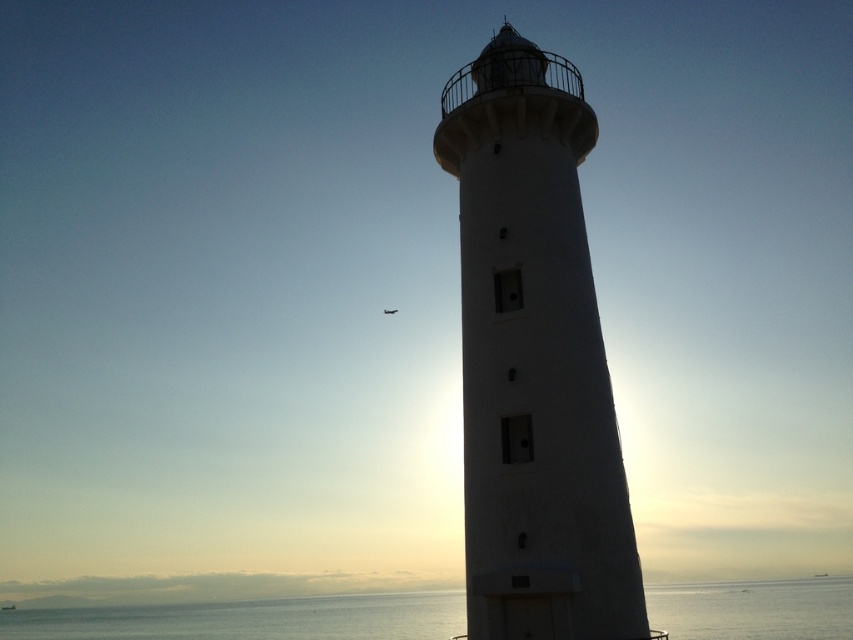
Question: Does white smooth lighthouse at center appear on the right side of transparent water at lower center?

Choices:
 (A) no
 (B) yes

Answer: (B)

Question: Is white smooth lighthouse at center further to camera compared to transparent water at lower center?

Choices:
 (A) no
 (B) yes

Answer: (A)

Question: Which of the following is the farthest from the observer?

Choices:
 (A) transparent water at lower center
 (B) white smooth lighthouse at center

Answer: (A)

Question: Which object appears farthest from the camera in this image?

Choices:
 (A) white smooth lighthouse at center
 (B) transparent water at lower center

Answer: (B)

Question: From the image, what is the correct spatial relationship of white smooth lighthouse at center in relation to transparent water at lower center?

Choices:
 (A) above
 (B) below

Answer: (A)